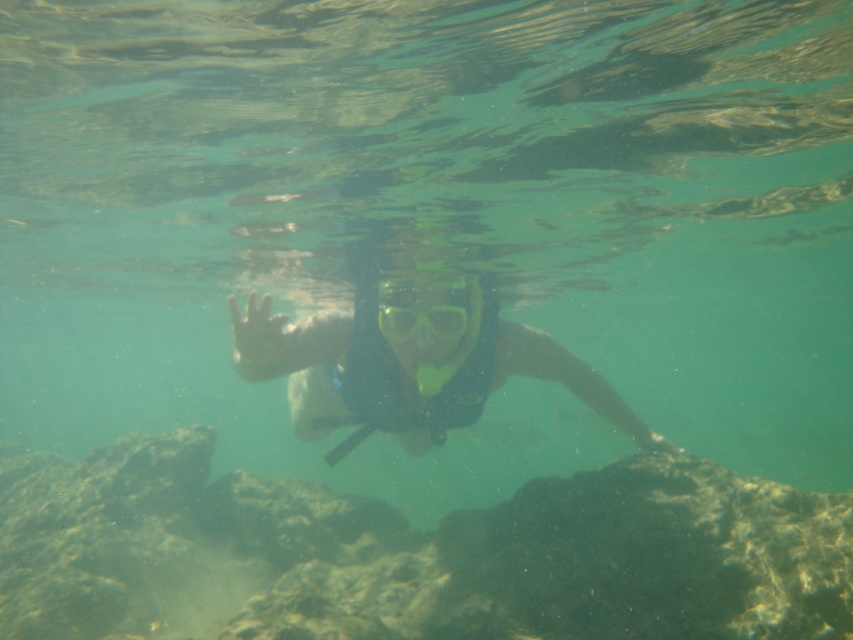
Is point (376, 280) in front of point (379, 308)?

No.

Is transparent rubber snorkel at center to the right of transparent plastic goggles at center from the viewer's perspective?

Correct, you'll find transparent rubber snorkel at center to the right of transparent plastic goggles at center.

Is point (235, 301) closer to viewer compared to point (445, 307)?

Yes, point (235, 301) is closer to viewer.

The height and width of the screenshot is (640, 853). What are the coordinates of `transparent rubber snorkel at center` in the screenshot? It's located at (408, 364).